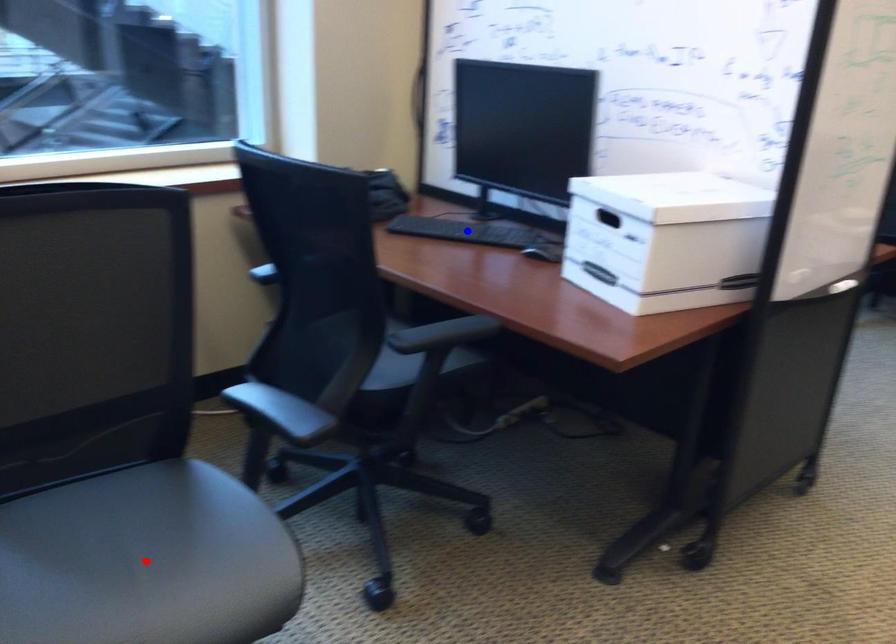
Question: Which of the two points in the image is closer to the camera?

Choices:
 (A) Blue point is closer.
 (B) Red point is closer.

Answer: (B)